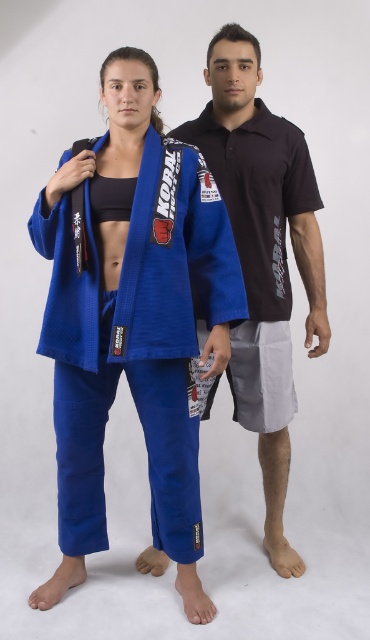
Question: Does blue fabric kimono at center appear over matte black polo shirt at center?

Choices:
 (A) yes
 (B) no

Answer: (B)

Question: Is blue fabric kimono at center further to camera compared to matte black polo shirt at center?

Choices:
 (A) yes
 (B) no

Answer: (B)

Question: Which point appears closest to the camera in this image?

Choices:
 (A) (288, 548)
 (B) (186, 147)

Answer: (B)

Question: Does blue fabric kimono at center appear under matte black polo shirt at center?

Choices:
 (A) no
 (B) yes

Answer: (B)

Question: Which of the following is the closest to the observer?

Choices:
 (A) matte black polo shirt at center
 (B) blue fabric kimono at center

Answer: (B)